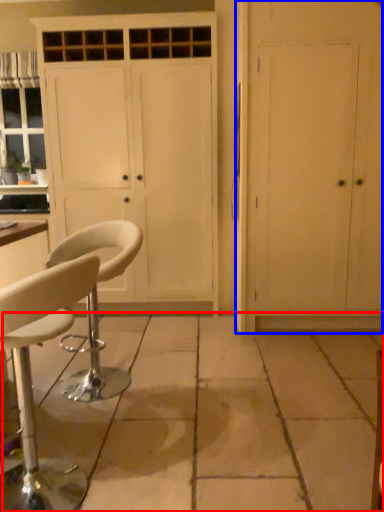
Question: Which of the following is the closest to the observer, concrete (highlighted by a red box) or door (highlighted by a blue box)?

Choices:
 (A) concrete
 (B) door

Answer: (A)